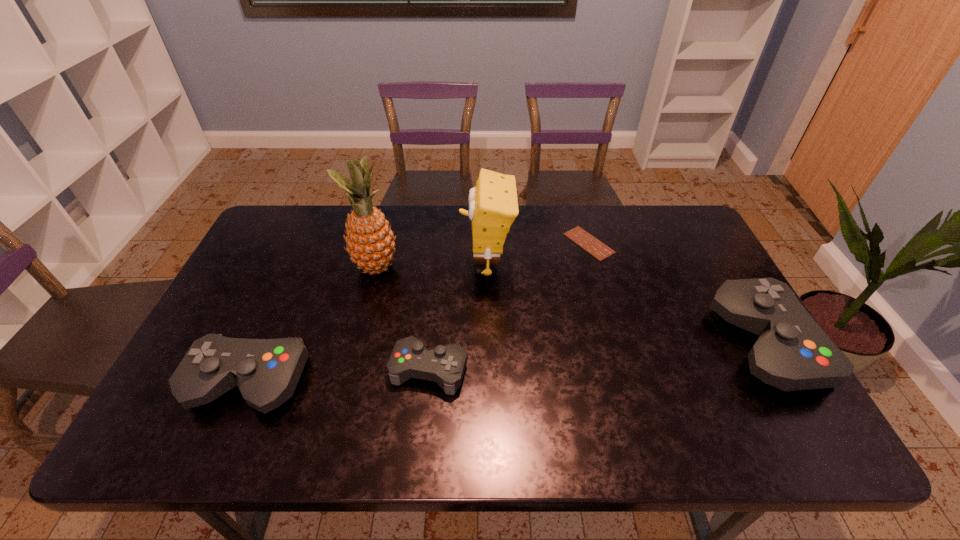
To achieve even spacing by inserting another control among them, please point to a vacant spot for this new control. Please provide its 2D coordinates. Your answer should be formatted as a tuple, i.e. [(x, y)], where the tuple contains the x and y coordinates of a point satisfying the conditions above.

[(601, 357)]